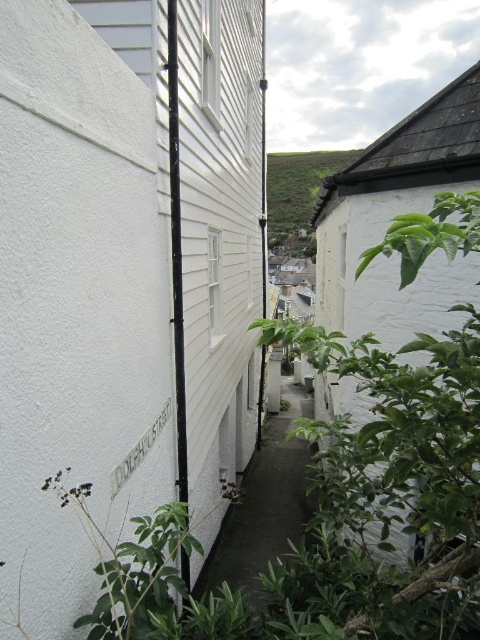
Question: Estimate the real-world distances between objects in this image. Which object is farther from the dark gray concrete alley at center?

Choices:
 (A) green leafy plant at upper center
 (B) green leafy plant at lower center

Answer: (A)

Question: Is dark gray concrete alley at center to the right of green leafy plant at lower center from the viewer's perspective?

Choices:
 (A) yes
 (B) no

Answer: (A)

Question: Observing the image, what is the correct spatial positioning of dark gray concrete alley at center in reference to green leafy plant at upper center?

Choices:
 (A) left
 (B) right

Answer: (A)

Question: Is green leafy plant at lower center positioned behind green leafy plant at upper center?

Choices:
 (A) no
 (B) yes

Answer: (A)

Question: Which of the following is the farthest from the observer?

Choices:
 (A) (285, 173)
 (B) (267, 480)
 (C) (163, 605)

Answer: (A)

Question: Among these points, which one is nearest to the camera?

Choices:
 (A) (299, 192)
 (B) (276, 413)
 (C) (62, 481)

Answer: (C)